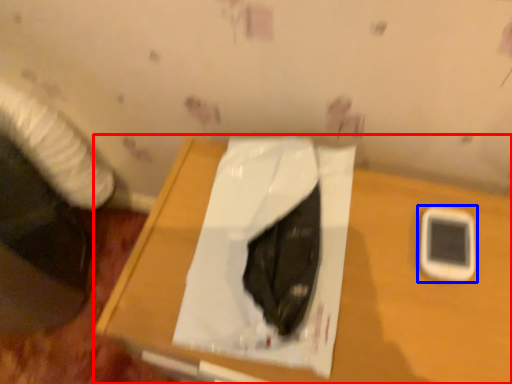
Question: Among these objects, which one is nearest to the camera, table (highlighted by a red box) or mobile phone (highlighted by a blue box)?

Choices:
 (A) table
 (B) mobile phone

Answer: (A)